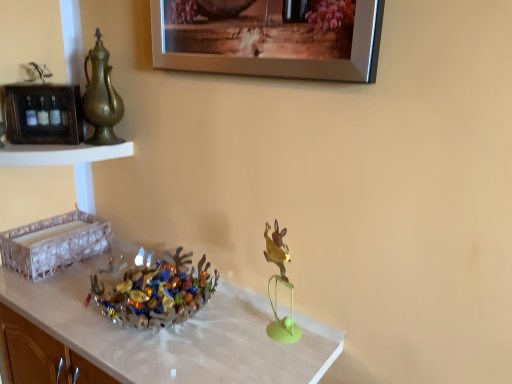
Locate an element on the screen. The image size is (512, 384). vacant space in between translucent glass tray at left, positioned as the first shelf in bottom-to-top order, and translucent glass bowl at center is located at coordinates (88, 275).